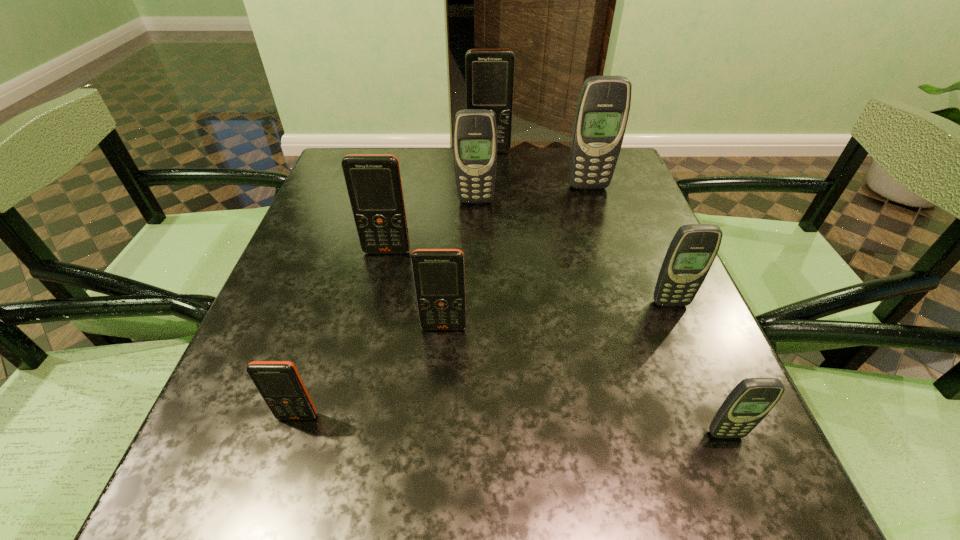
Find the location of a particular element. The image size is (960, 540). the third farthest orange cellular telephone is located at coordinates (439, 275).

Where is `the third nearest cellular telephone`? Image resolution: width=960 pixels, height=540 pixels. the third nearest cellular telephone is located at coordinates (439, 275).

At what (x,y) coordinates should I click in order to perform the action: click on the nearest orange cellular telephone. Please return your answer as a coordinate pair (x, y). The width and height of the screenshot is (960, 540). Looking at the image, I should click on (279, 383).

Locate an element on the screen. the seventh farthest object is located at coordinates (279, 383).

You are a GUI agent. You are given a task and a screenshot of the screen. Output one action in this format:
    pyautogui.click(x=<x>, y=<y>)
    Task: Click on the smallest gray cellular telephone
    Image resolution: width=960 pixels, height=540 pixels.
    Given the screenshot: What is the action you would take?
    pyautogui.click(x=752, y=399)

Image resolution: width=960 pixels, height=540 pixels. Find the location of `the nearest gray cellular telephone`. the nearest gray cellular telephone is located at coordinates (752, 399).

Where is `blank space located 0.140m on the screen of the farthest cellular telephone`? The height and width of the screenshot is (540, 960). blank space located 0.140m on the screen of the farthest cellular telephone is located at coordinates (490, 181).

What are the coordinates of `free region located 0.320m on the screen of the farthest gray cellular telephone` in the screenshot? It's located at (617, 279).

I want to click on vacant space situated on the screen of the fourth farthest cellular telephone, so click(x=351, y=407).

Locate an element on the screen. The width and height of the screenshot is (960, 540). free space located 0.050m on the screen of the sixth nearest cellular telephone is located at coordinates (475, 217).